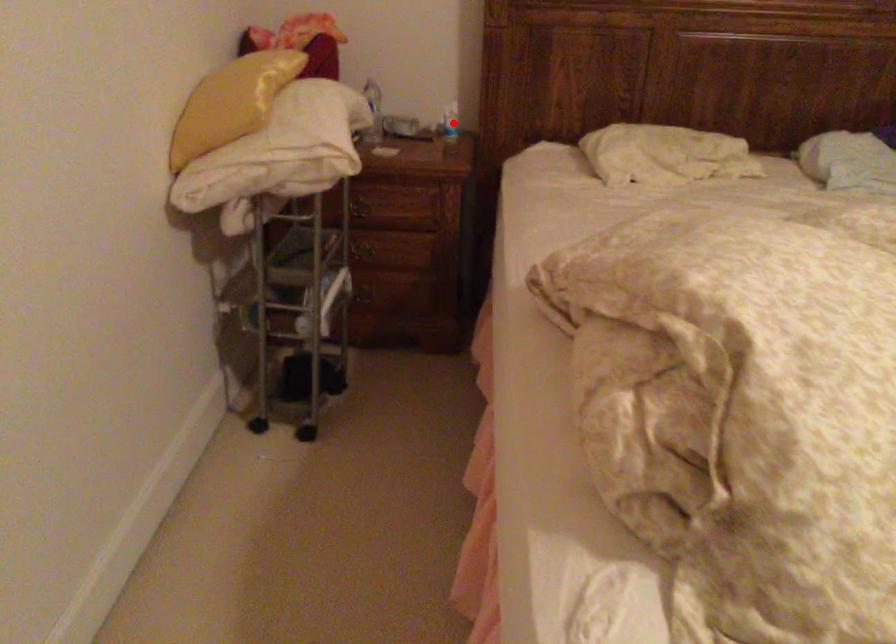
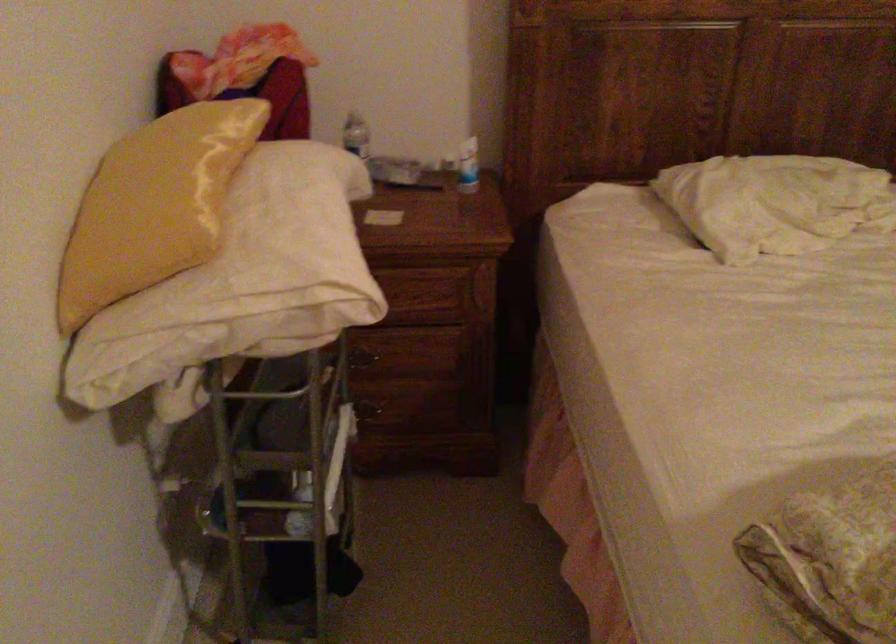
In the second image, find the point that corresponds to the highlighted location in the first image.

(468, 166)